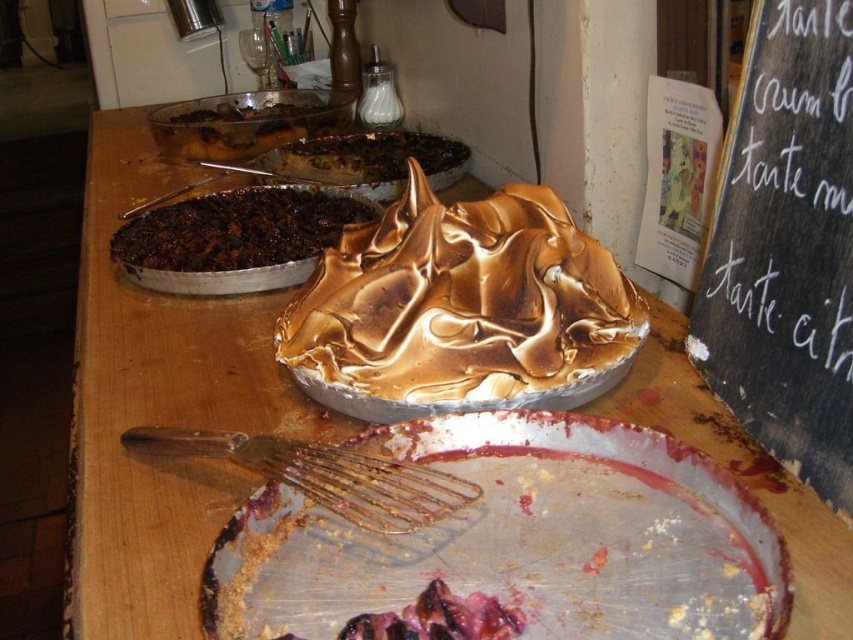
Question: Considering the relative positions of dark brown crumbly pie at upper left and gold metallic whisk at center in the image provided, where is dark brown crumbly pie at upper left located with respect to gold metallic whisk at center?

Choices:
 (A) right
 (B) left

Answer: (B)

Question: Which of the following is the farthest from the observer?

Choices:
 (A) gold metallic whisk at center
 (B) golden brown meringue at center

Answer: (B)

Question: Which of the following is the farthest from the observer?

Choices:
 (A) (775, 556)
 (B) (421, 136)

Answer: (B)

Question: Is gold metallic whisk at center to the left of burnt chocolate cake at center from the viewer's perspective?

Choices:
 (A) no
 (B) yes

Answer: (B)

Question: Is black chalkboard at upper right positioned before burnt chocolate cake at center?

Choices:
 (A) no
 (B) yes

Answer: (B)

Question: Which object is farther from the camera taking this photo?

Choices:
 (A) dark brown crumbly pie at upper left
 (B) metallic silver platter at center
 (C) black chalkboard at upper right

Answer: (A)